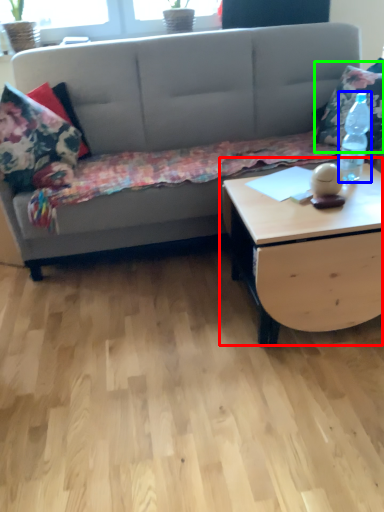
Question: Which is nearer to the coffee table (highlighted by a red box)? bottle (highlighted by a blue box) or throw pillow (highlighted by a green box).

Choices:
 (A) bottle
 (B) throw pillow

Answer: (A)